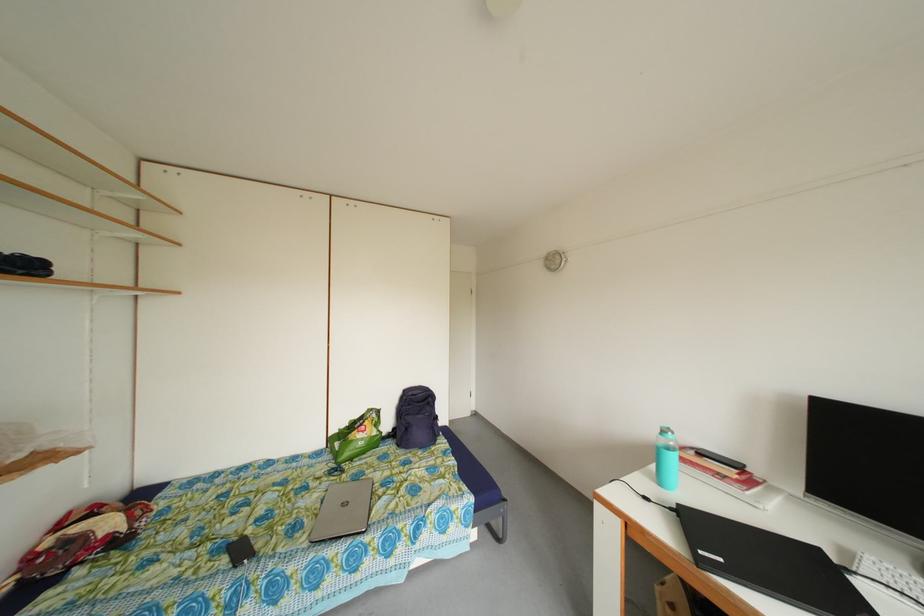
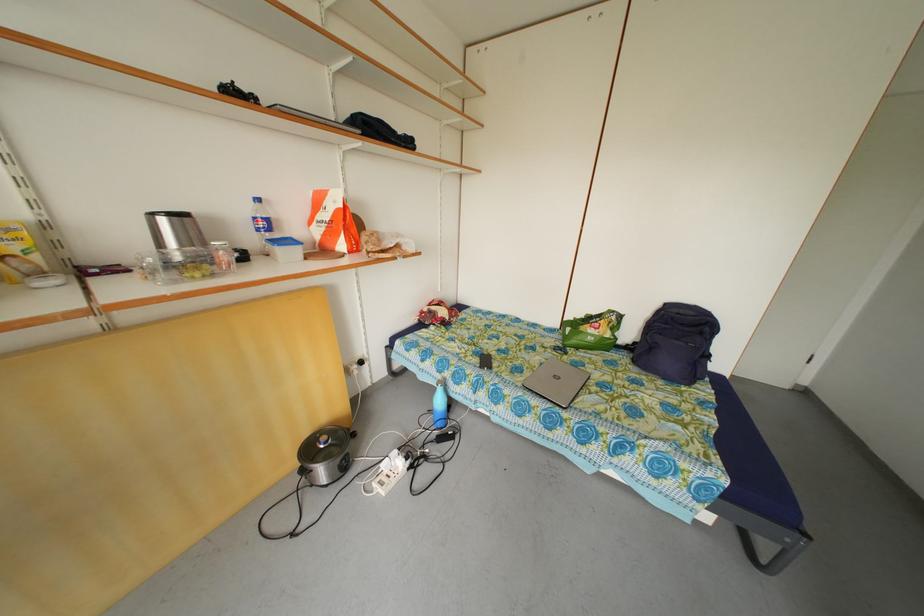
Find the pixel in the second image that matches point 411,397 in the first image.

(673, 310)